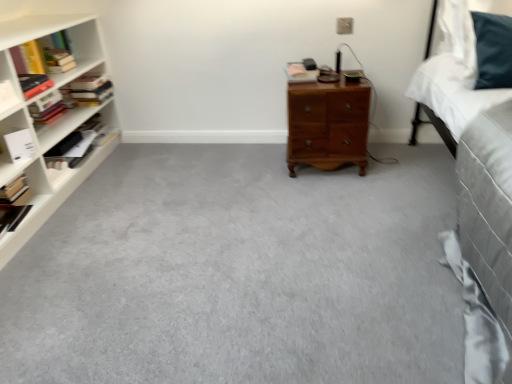
Locate an element on the screen. This screenshot has height=384, width=512. vacant region in front of wooden nightstand at center is located at coordinates click(x=334, y=190).